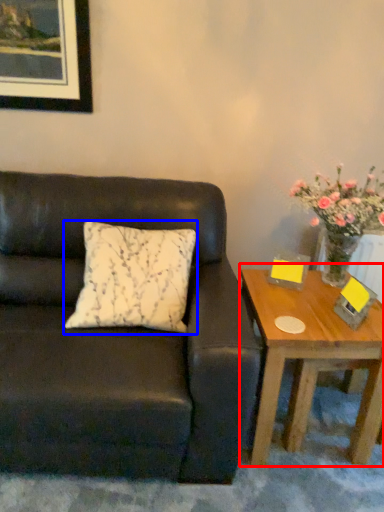
Question: Which object appears farthest to the camera in this image, coffee table (highlighted by a red box) or pillow (highlighted by a blue box)?

Choices:
 (A) coffee table
 (B) pillow

Answer: (A)